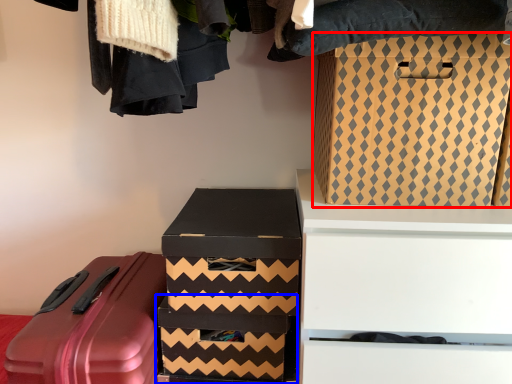
Question: Which object appears farthest to the camera in this image, box (highlighted by a red box) or box (highlighted by a blue box)?

Choices:
 (A) box
 (B) box

Answer: (B)